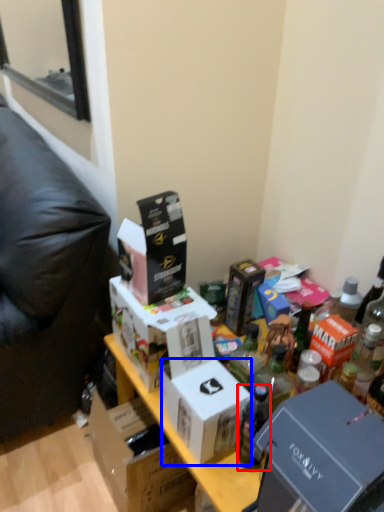
Question: Which object is closer to the camera taking this photo, bottle (highlighted by a red box) or box (highlighted by a blue box)?

Choices:
 (A) bottle
 (B) box

Answer: (B)